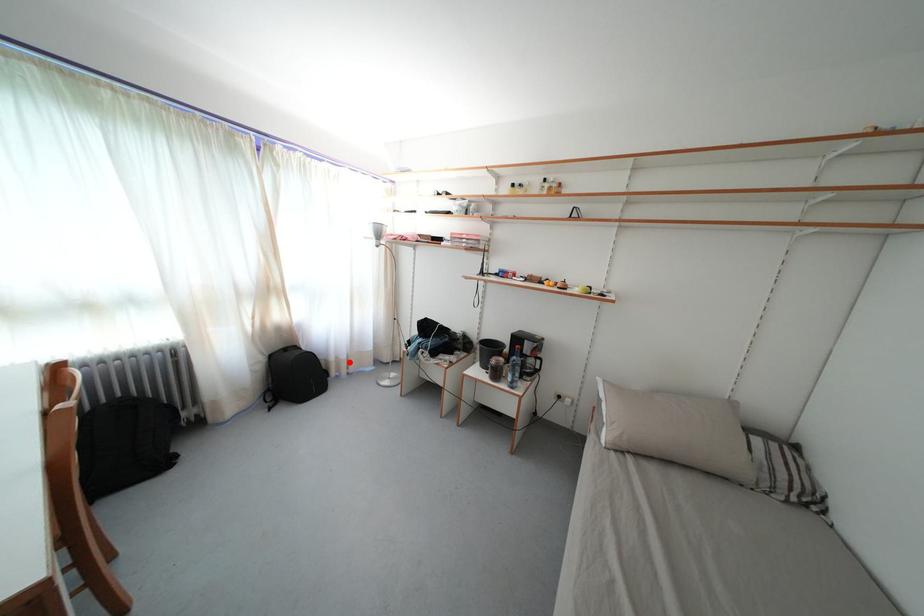
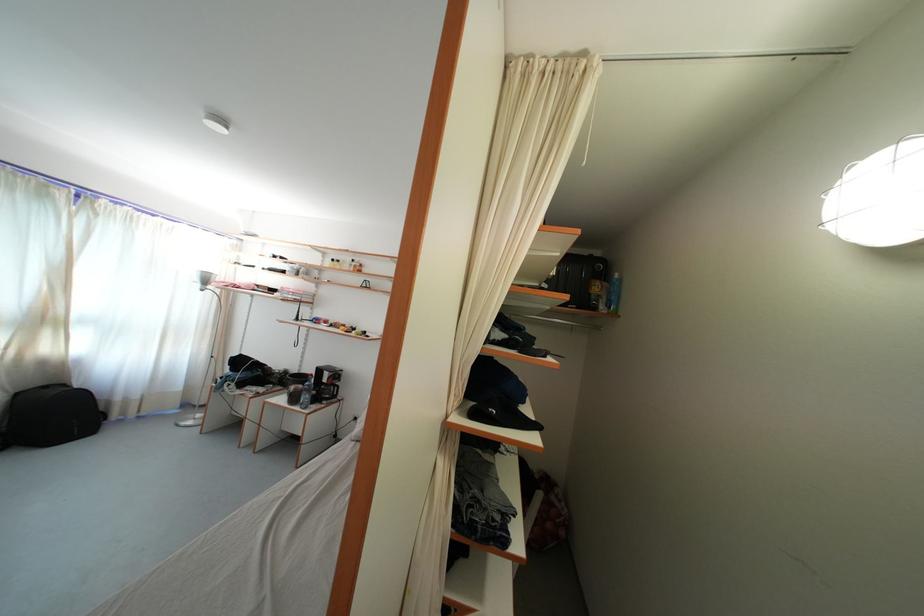
Question: I am providing you with two images of the same scene from different viewpoints. A red point is shown in image1. For the corresponding object point in image2, is it positioned nearer or farther from the camera?

Choices:
 (A) Nearer
 (B) Farther

Answer: (A)